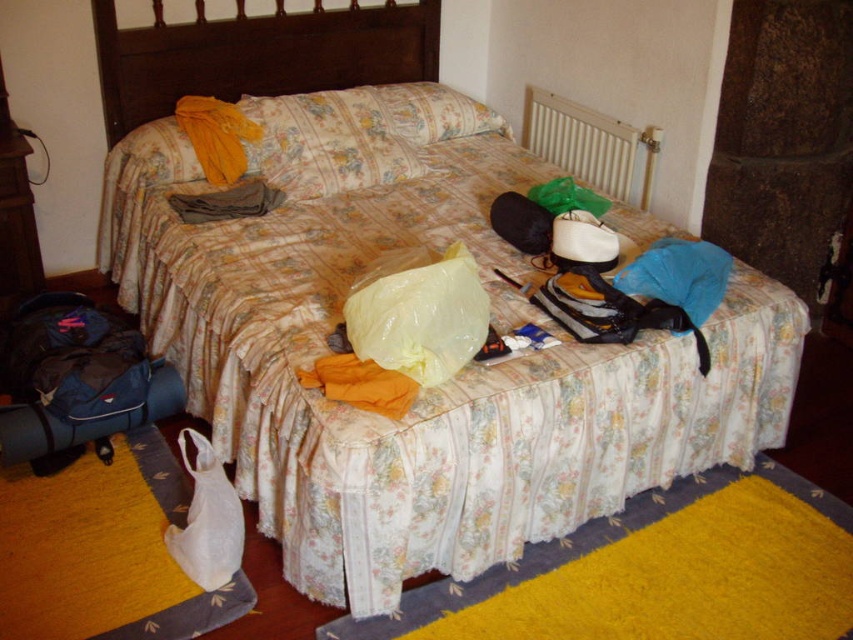
Who is lower down, white plastic bag at lower left or wooden dresser at left?

white plastic bag at lower left is lower down.

Which is behind, point (187, 435) or point (4, 166)?

The point (187, 435) is behind.

Which is in front, point (169, 545) or point (27, 234)?

Point (169, 545) is in front.

The image size is (853, 640). I want to click on white plastic bag at lower left, so click(207, 518).

I want to click on white plastic bag at lower left, so point(207,518).

Consider the image. Between white plastic bag at lower left and floral fabric pillow at center, which one has less height?

With less height is floral fabric pillow at center.

Which is in front, point (236, 515) or point (450, 88)?

Point (236, 515) is more forward.

Find the location of a particular element. The width and height of the screenshot is (853, 640). white plastic bag at lower left is located at coordinates (207, 518).

Is yellow plastic bag at center closer to camera compared to white plastic bag at lower left?

Yes, it is.

Measure the distance between point (x=456, y=360) and camera.

A distance of 5.79 feet exists between point (x=456, y=360) and camera.

Who is more forward, (457, 323) or (231, 566)?

Point (457, 323)

At what (x,y) coordinates should I click in order to perform the action: click on yellow plastic bag at center. Please return your answer as a coordinate pair (x, y). Looking at the image, I should click on (418, 312).